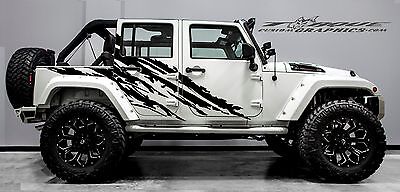
Identify the location of floor. (232, 151), (272, 177), (163, 187), (26, 179), (14, 159), (393, 168).